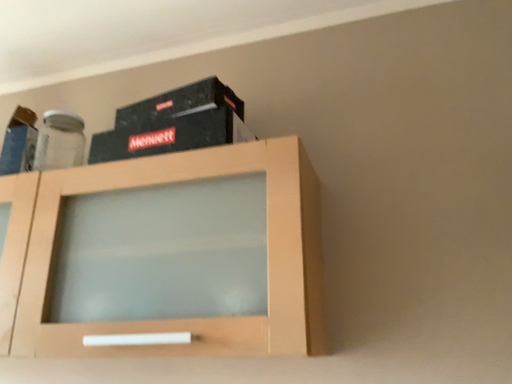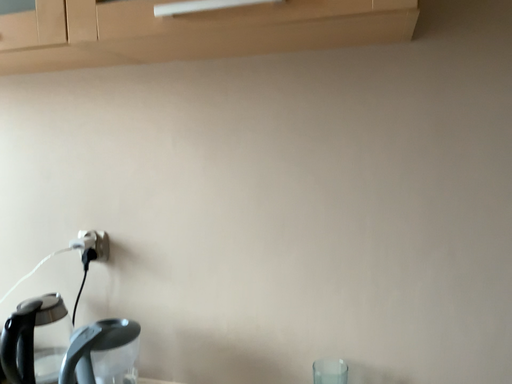
Question: Which way did the camera rotate in the video?

Choices:
 (A) rotated upward
 (B) rotated downward

Answer: (B)